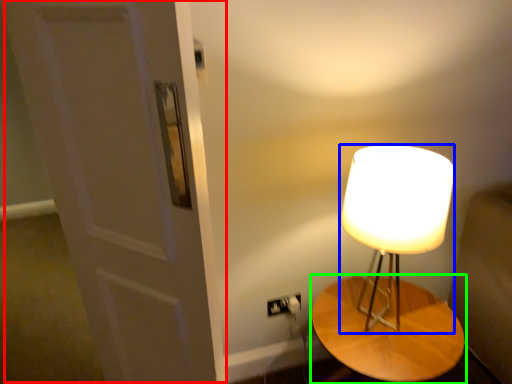
Question: Estimate the real-world distances between objects in this image. Which object is closer to door (highlighted by a red box), lamp (highlighted by a blue box) or table (highlighted by a green box)?

Choices:
 (A) lamp
 (B) table

Answer: (A)